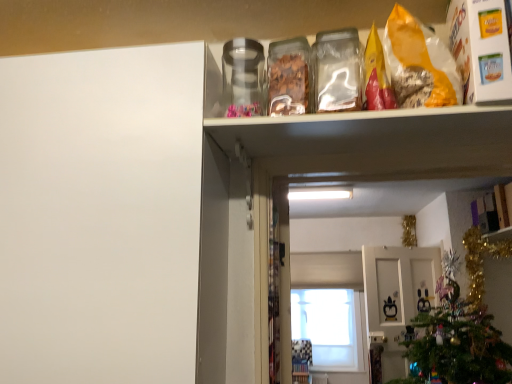
Question: Is transparent glass window at center oriented towards white matte cabinet door at left?

Choices:
 (A) yes
 (B) no

Answer: (A)

Question: From the image's perspective, is transparent glass window at center under white matte cabinet door at left?

Choices:
 (A) yes
 (B) no

Answer: (A)

Question: Is transparent glass window at center bigger than white matte cabinet door at left?

Choices:
 (A) no
 (B) yes

Answer: (A)

Question: Can you confirm if transparent glass window at center is positioned to the left of white matte cabinet door at left?

Choices:
 (A) no
 (B) yes

Answer: (A)

Question: Is white matte cabinet door at left at the back of transparent glass window at center?

Choices:
 (A) no
 (B) yes

Answer: (A)

Question: From a real-world perspective, does transparent glass window at center sit lower than white matte cabinet door at left?

Choices:
 (A) yes
 (B) no

Answer: (A)

Question: From the image's perspective, is white matte cabinet door at left below matte white cabinet at upper right?

Choices:
 (A) no
 (B) yes

Answer: (A)

Question: Can we say white matte cabinet door at left lies outside matte white cabinet at upper right?

Choices:
 (A) no
 (B) yes

Answer: (B)

Question: Does white matte cabinet door at left contain matte white cabinet at upper right?

Choices:
 (A) no
 (B) yes

Answer: (A)

Question: Is white matte cabinet door at left taller than matte white cabinet at upper right?

Choices:
 (A) no
 (B) yes

Answer: (B)

Question: From a real-world perspective, does white matte cabinet door at left sit lower than matte white cabinet at upper right?

Choices:
 (A) no
 (B) yes

Answer: (B)

Question: Is white matte cabinet door at left shorter than matte white cabinet at upper right?

Choices:
 (A) yes
 (B) no

Answer: (B)

Question: Could you tell me if matte white cabinet at upper right is facing white glossy cabinet doors at center?

Choices:
 (A) yes
 (B) no

Answer: (B)